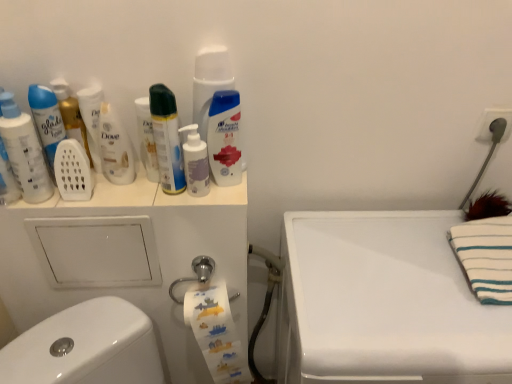
The image size is (512, 384). What are the coordinates of `free space to the left of white matte pump bottle at center, the fifth mouthwash viewed from the left` in the screenshot? It's located at (134, 200).